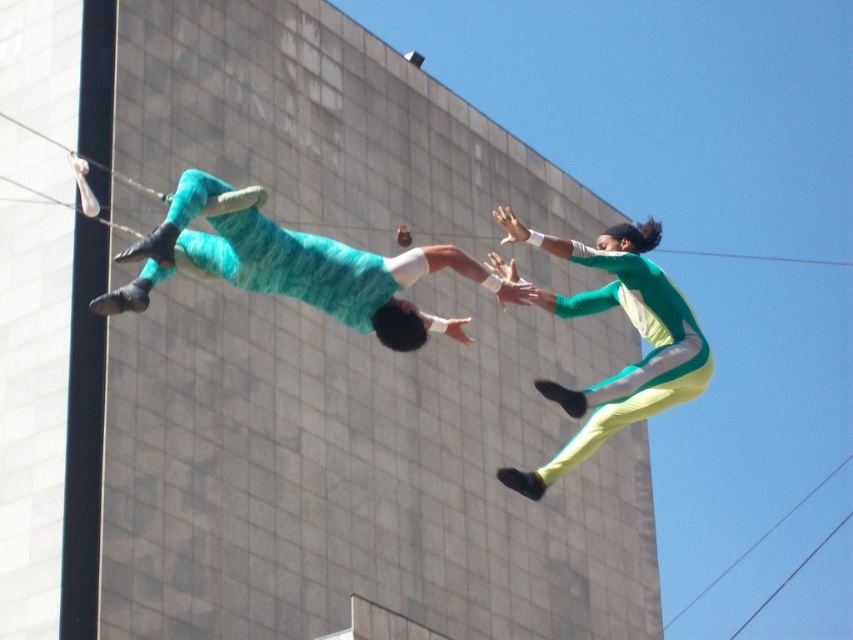
Question: Which object appears farthest from the camera in this image?

Choices:
 (A) teal fabric body at center
 (B) green matte jumpsuit at upper right

Answer: (B)

Question: Is teal fabric body at center closer to camera compared to green matte jumpsuit at upper right?

Choices:
 (A) no
 (B) yes

Answer: (B)

Question: Is teal fabric body at center to the left of green matte jumpsuit at upper right from the viewer's perspective?

Choices:
 (A) yes
 (B) no

Answer: (A)

Question: Which point is farther from the camera taking this photo?

Choices:
 (A) (256, 225)
 (B) (540, 301)

Answer: (B)

Question: Can you confirm if teal fabric body at center is positioned to the left of green matte jumpsuit at upper right?

Choices:
 (A) yes
 (B) no

Answer: (A)

Question: Which point is farther to the camera?

Choices:
 (A) green matte jumpsuit at upper right
 (B) teal fabric body at center

Answer: (A)